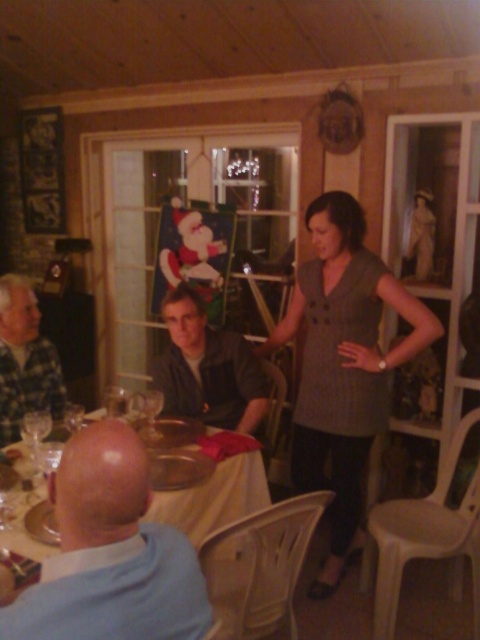
You are a guest at this cozy indoor gathering and need to decide which item to take home as a keepsake. Both the gray textured dress at center and the dark gray fabric shirt at center are available. If you prefer something roomier, which one should you choose?

The gray textured dress at center has a larger size compared to the dark gray fabric shirt at center, so you should choose the gray textured dress at center for a roomier option.